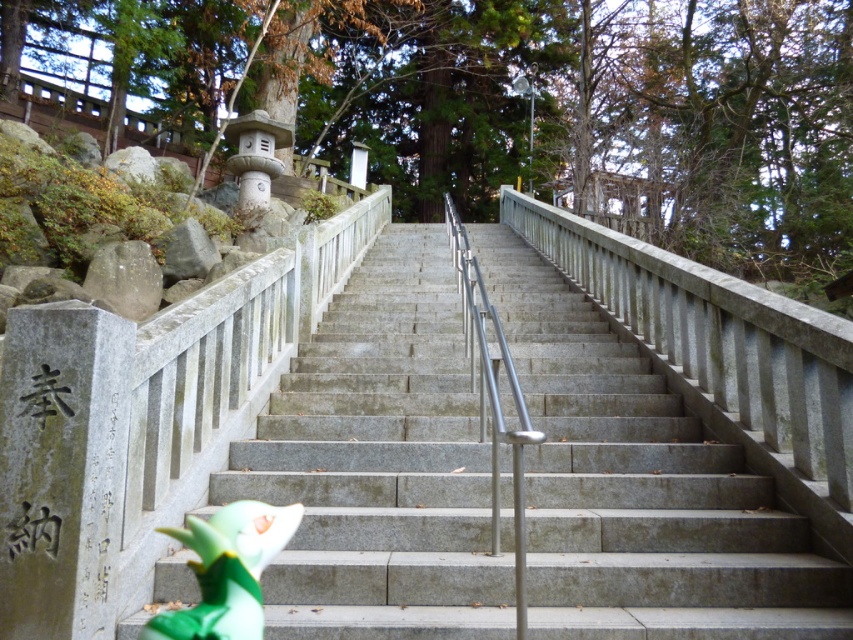
Is point (692, 564) positioned after point (229, 560)?

Yes.

Between point (456, 346) and point (161, 529), which one is positioned behind?

Positioned behind is point (456, 346).

Locate an element on the screen. gray stone stairs at center is located at coordinates (381, 465).